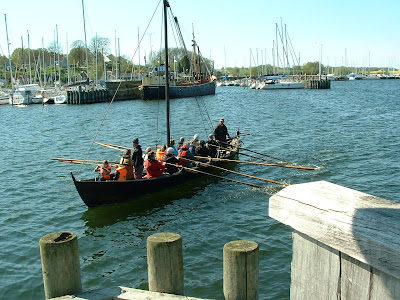
Image resolution: width=400 pixels, height=300 pixels. I want to click on pillars, so click(x=53, y=267), click(x=164, y=257), click(x=237, y=264).